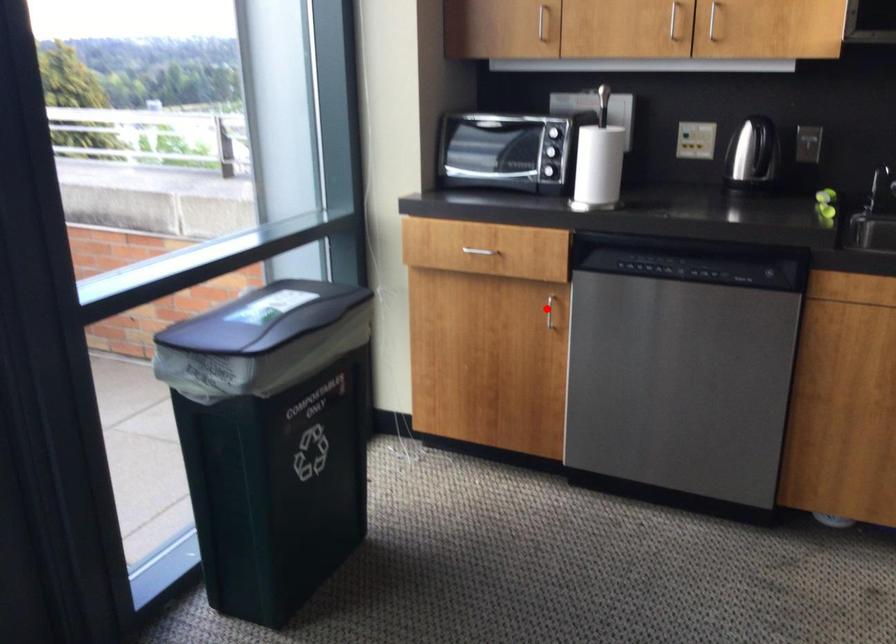
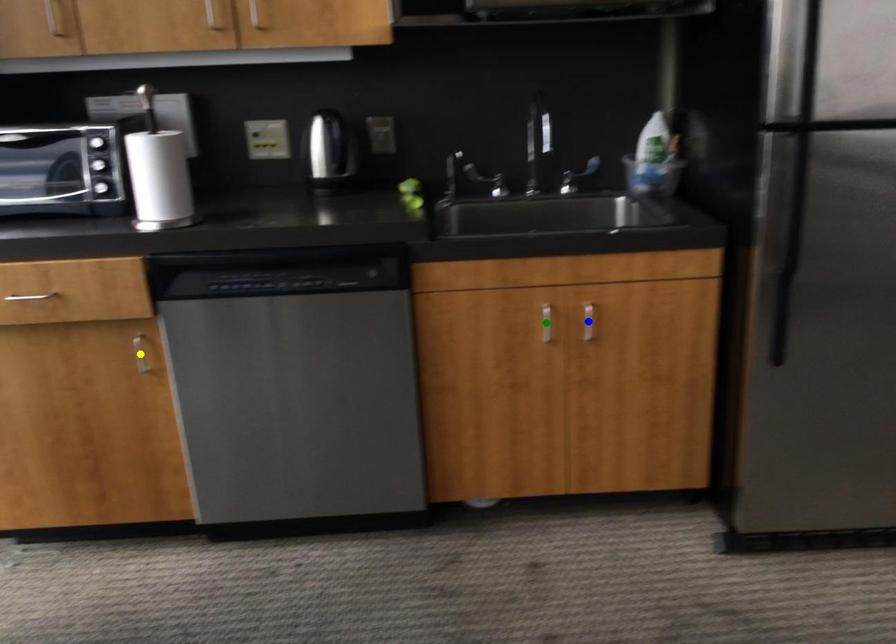
Question: I am providing you with two images of the same scene from different viewpoints. A red point is marked on the first image. You are given multiple points on the second image. Can you choose the point in image 2 that corresponds to the point in image 1?

Choices:
 (A) yellow point
 (B) blue point
 (C) green point

Answer: (A)